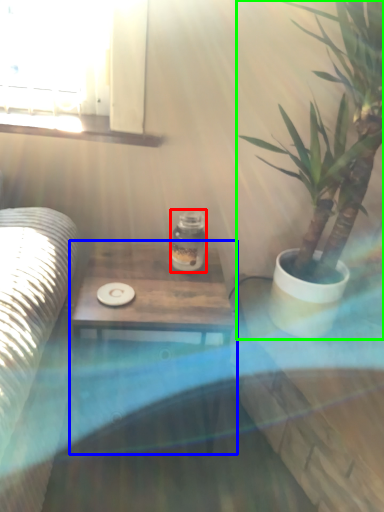
Question: Which is nearer to the glass jar (highlighted by a red box)? table (highlighted by a blue box) or houseplant (highlighted by a green box).

Choices:
 (A) table
 (B) houseplant

Answer: (A)